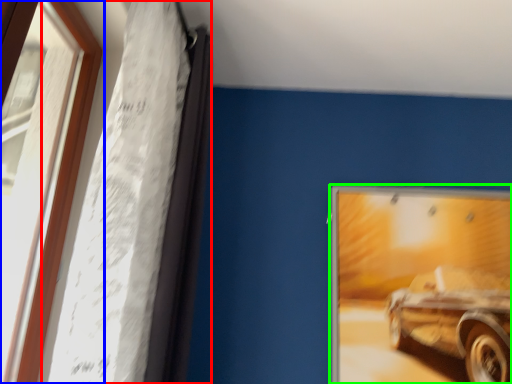
Question: Which object is the farthest from curtain (highlighted by a red box)? Choose among these: window (highlighted by a blue box) or picture frame (highlighted by a green box).

Choices:
 (A) window
 (B) picture frame

Answer: (B)